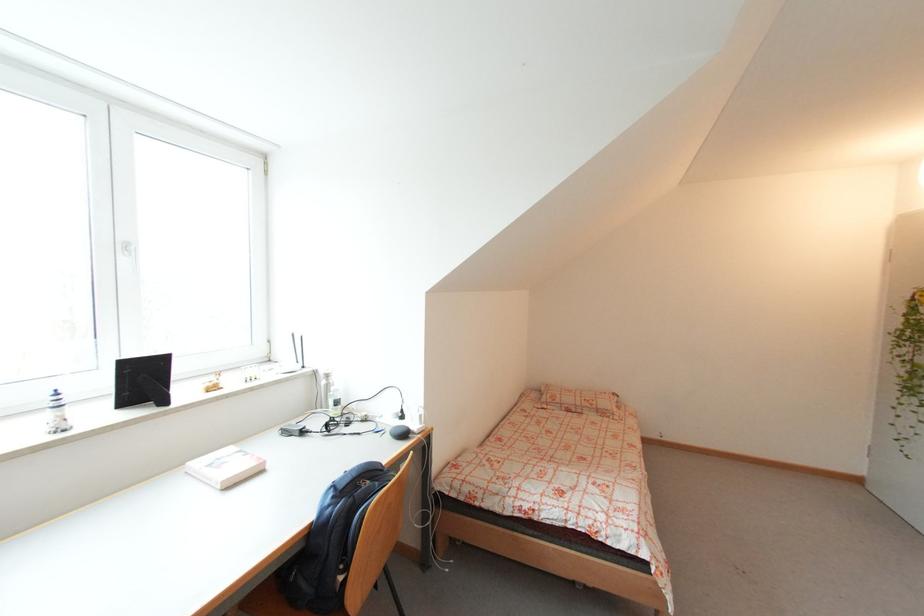
Image resolution: width=924 pixels, height=616 pixels. I want to click on white book, so click(225, 467).